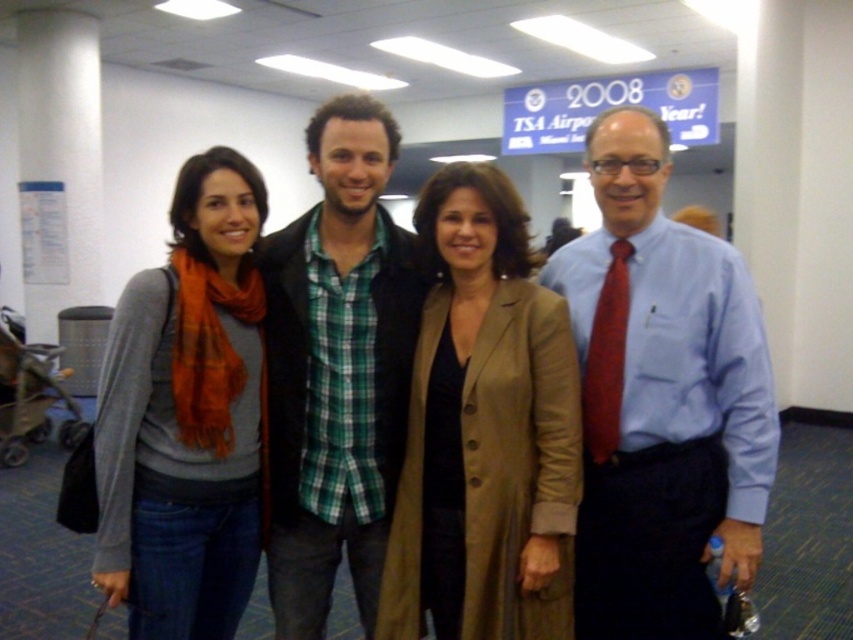
You are standing in the airport corridor and see the matte blue shirt at center. Can you estimate its position in terms of coordinates?

The matte blue shirt at center is located at coordinates approximately 0.625 on the x axis and 0.776 on the y axis.